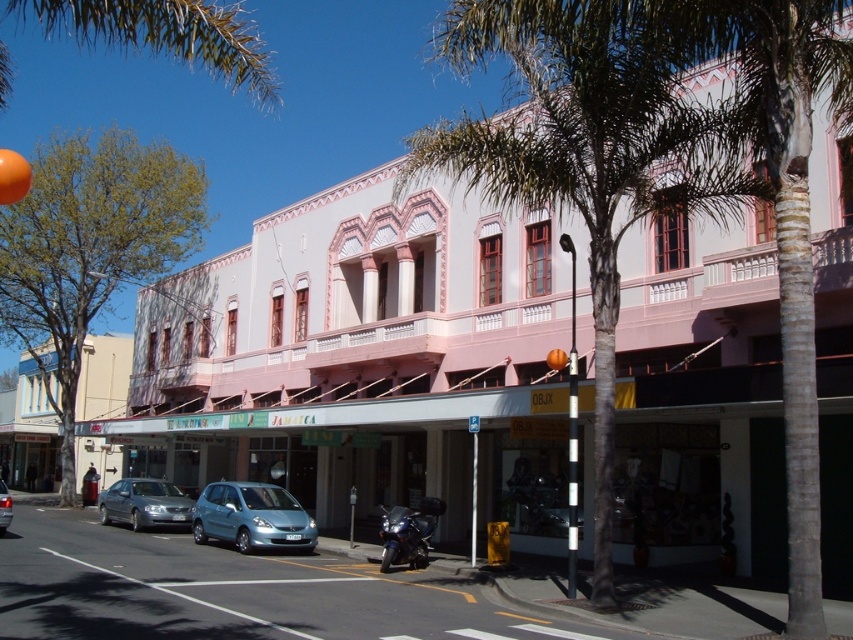
You are a delivery person trying to park your motorcycle between the green leafy palm tree at center and the silver metallic hatchback at center. Can you fit your motorcycle in the space between them?

The green leafy palm tree at center is bigger than the silver metallic hatchback at center, so the space between them might be too narrow for the motorcycle to fit comfortably. The palm tree is larger in size, which could reduce the available space between the two objects.

You are standing at the point with coordinates (585, 154) in the image. What object are you standing on?

You are standing on the green leafy palm tree at center.